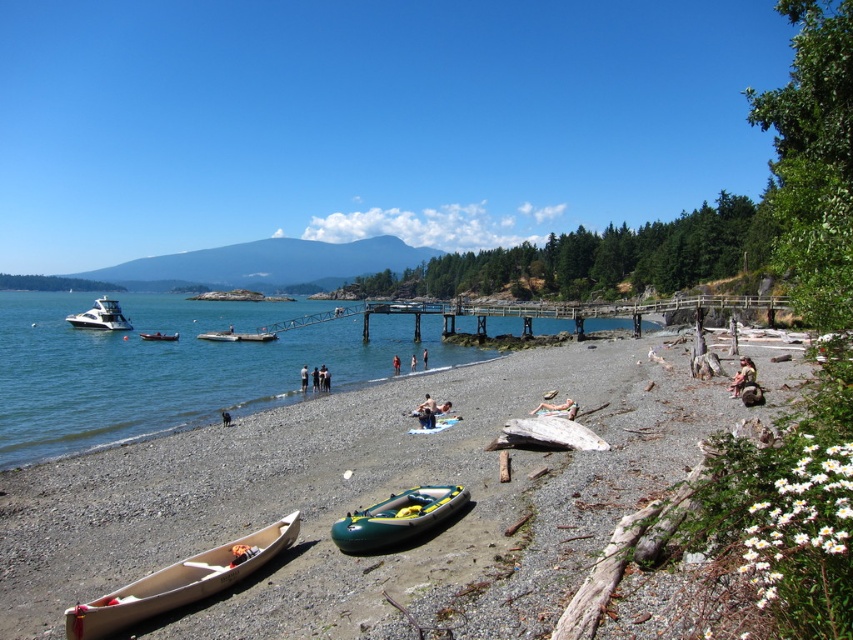
You are a photographer positioned at the edge of the beach, aiming to capture a photo that includes both the tan fabric towel at lower center and the red fabric person at center. Based on their positions, which object should you adjust your camera angle to focus on first to ensure both are in frame?

The tan fabric towel at lower center is to the right of the red fabric person at center. To include both in the frame, adjust your camera angle to focus on the red fabric person at center first, then pan slightly to the right to include the tan fabric towel at lower center.

You are a photographer standing on the beach and want to capture both the shiny white motorboat at left and the tan fabric towel at lower center in a single shot. Which object should you focus on first to ensure both are in frame?

You should focus on the tan fabric towel at lower center first because the shiny white motorboat at left is located above it, so adjusting the camera angle downward will include both.

You are a photographer trying to capture a wide shot of the beach scene. You notice the tan fabric towel at lower center and the red fabric person at center. Which object is wider in the image?

The tan fabric towel at lower center is wider than the red fabric person at center.